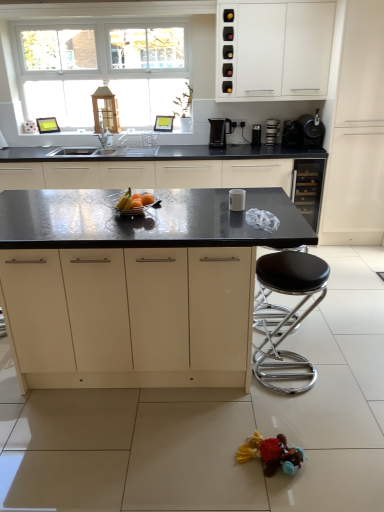
Where is `vacant area on top of metallic silver bowl at center (from a real-world perspective)`? vacant area on top of metallic silver bowl at center (from a real-world perspective) is located at coordinates (132, 197).